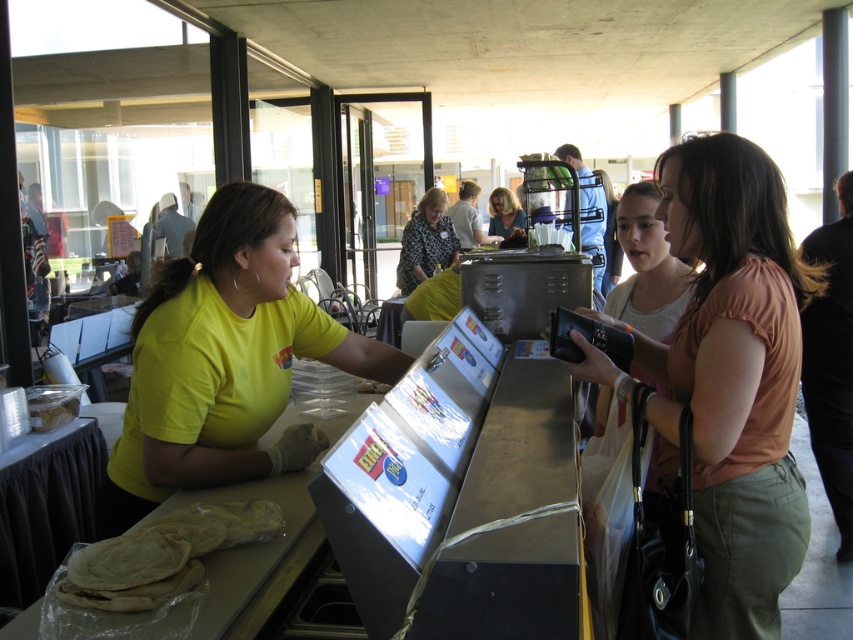
Question: Which of the following is the farthest from the observer?

Choices:
 (A) (503, 221)
 (B) (91, 552)
 (C) (593, 368)

Answer: (A)

Question: Does matte peach blouse at center have a smaller size compared to light brown leather jacket at right?

Choices:
 (A) yes
 (B) no

Answer: (B)

Question: Which of the following is the farthest from the observer?

Choices:
 (A) (693, 257)
 (B) (840, 380)
 (C) (525, 224)
 (D) (160, 332)

Answer: (C)

Question: Based on their relative distances, which object is nearer to the yellow t-shirt at center?

Choices:
 (A) matte peach blouse at center
 (B) matte black camera at center
 (C) translucent plastic tortillas at center
 (D) patterned fabric blouse at center

Answer: (C)

Question: Is yellow t-shirt at center wider than light brown leather jacket at right?

Choices:
 (A) yes
 (B) no

Answer: (A)

Question: In this image, where is translucent plastic tortillas at center located relative to light brown leather jacket at right?

Choices:
 (A) left
 (B) right

Answer: (A)